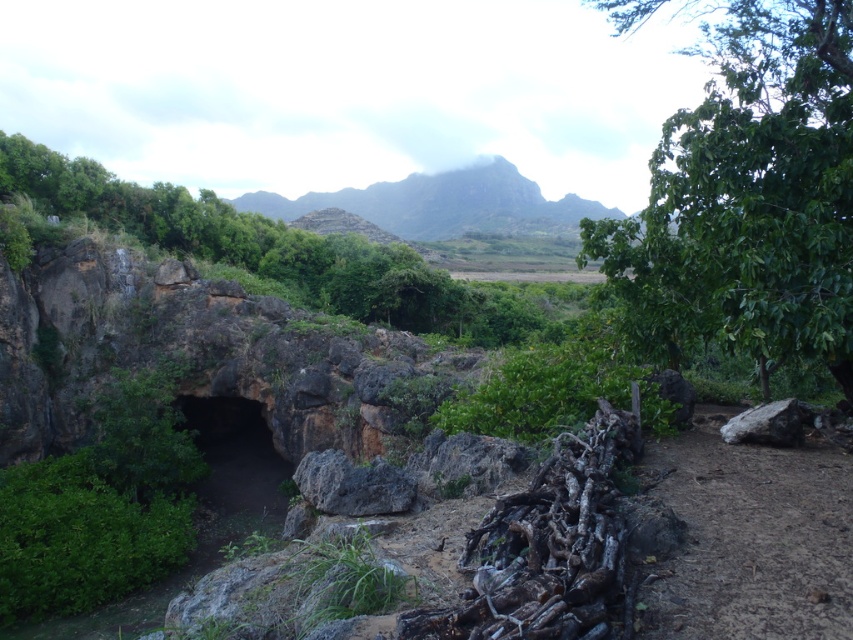
Question: Can you confirm if rugged stone mountain at upper center is bigger than rough textured rock at center?

Choices:
 (A) no
 (B) yes

Answer: (B)

Question: Which point is farther to the camera?

Choices:
 (A) rugged stone mountain at upper center
 (B) green leafy tree at upper right
 (C) rough textured rock at center

Answer: (A)

Question: Among these objects, which one is nearest to the camera?

Choices:
 (A) gray rough rock at right
 (B) rugged stone mountain at upper center
 (C) green mossy cave at center
 (D) rough textured rock at center

Answer: (D)

Question: Which point is closer to the camera taking this photo?

Choices:
 (A) (300, 198)
 (B) (328, 449)
 (C) (218, 477)
 (D) (740, 420)

Answer: (D)

Question: Does rough textured rock at center come in front of gray rough rock at right?

Choices:
 (A) no
 (B) yes

Answer: (B)

Question: Does green leafy tree at upper right appear on the right side of green mossy cave at center?

Choices:
 (A) no
 (B) yes

Answer: (B)